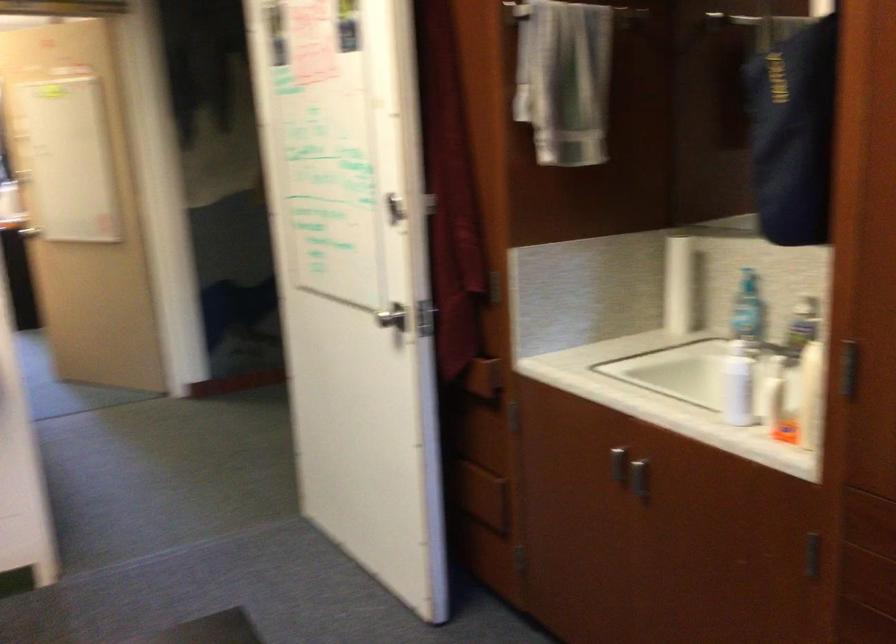
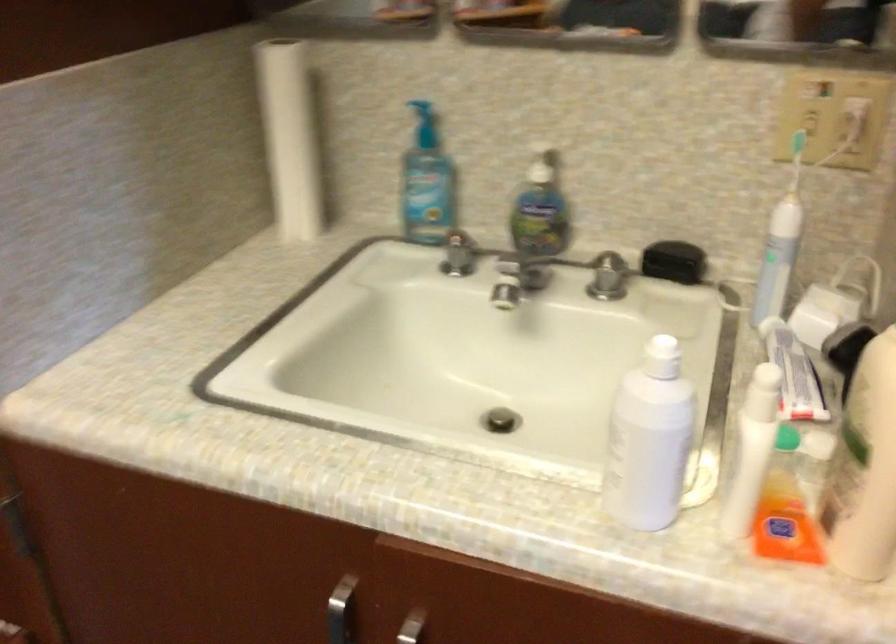
Find the pixel in the second image that matches the point at 642,460 in the first image.

(411, 627)